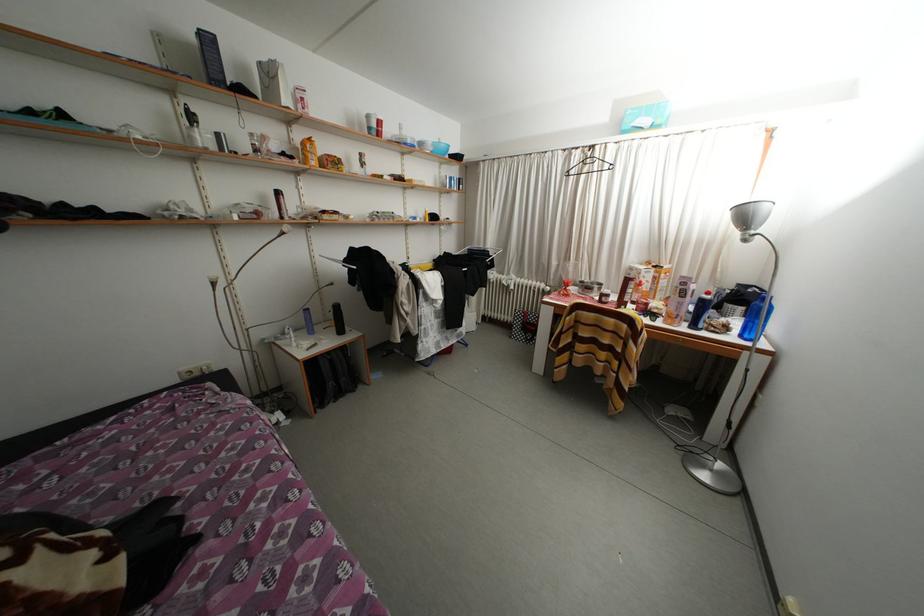
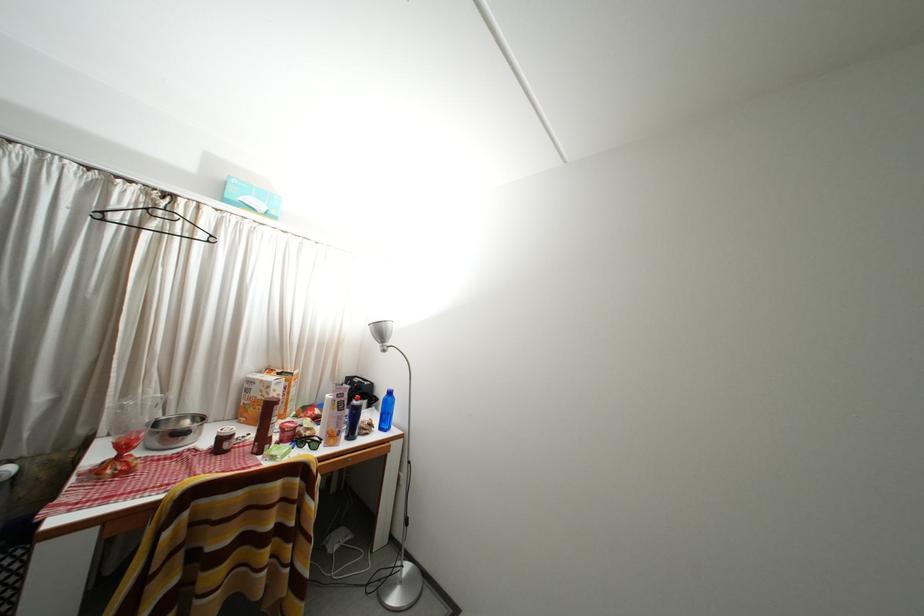
Find the pixel in the second image that matches point (638, 274) in the first image.

(259, 387)